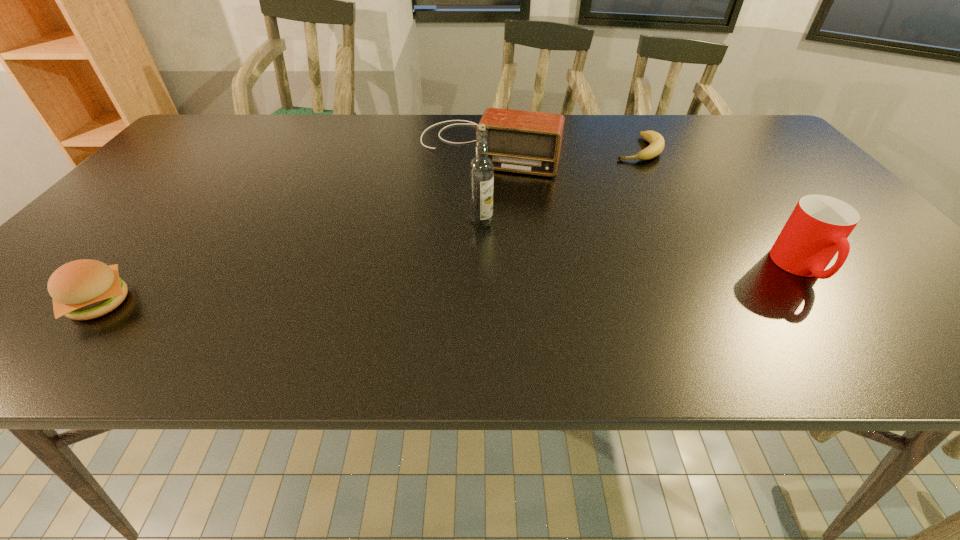
Find the location of a particular element. vacant space that satisfies the following two spatial constraints: 1. on the back side of the shortest object; 2. on the right side of the hamburger is located at coordinates click(228, 150).

Image resolution: width=960 pixels, height=540 pixels. Identify the location of free spot that satisfies the following two spatial constraints: 1. on the back side of the second shortest object; 2. on the left side of the tallest object. (166, 224).